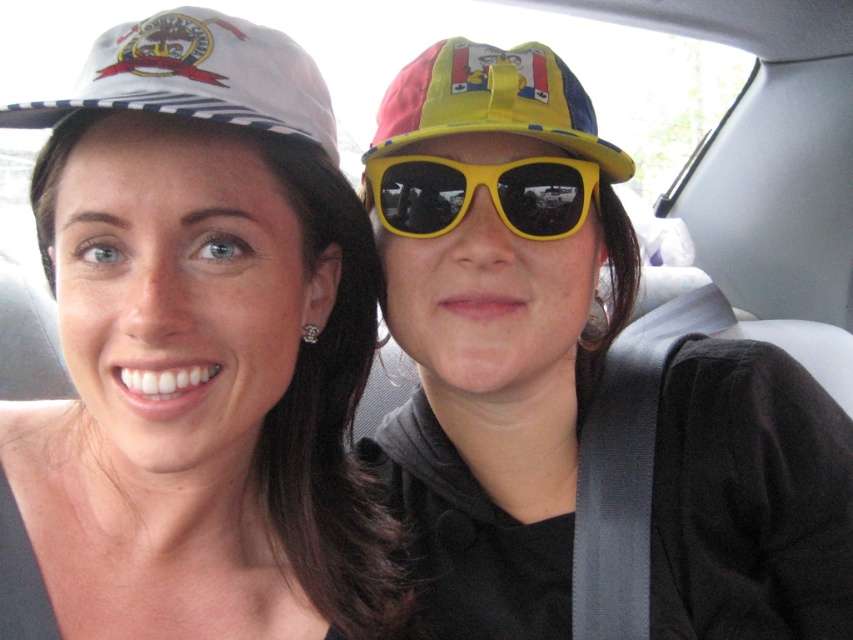
You are a photographer adjusting the camera focus. The yellow matte sunglasses at upper center and the yellow fabric cap at upper center are both in the frame. If the camera can only focus on objects within a 5 inch range, will both items be in focus?

The distance between the yellow matte sunglasses at upper center and the yellow fabric cap at upper center is 6.40 inches, which exceeds the camera focus range of 5 inches. Therefore, both items cannot be in focus simultaneously.

You are a photographer trying to capture a closeup shot of the two people in the car. You notice the white glossy hat at upper left and the white printed baseball cap at upper left. Which of these two hats has a wider brim?

The white glossy hat at upper left has a wider brim than the white printed baseball cap at upper left because its width surpasses the latter.

In the car scene, there are two hats visible at the upper left corner. The first is a white glossy hat at upper left and the second is a white printed baseball cap at upper left. Which of these two hats is positioned further to the left?

The white glossy hat at upper left is positioned to the left of the white printed baseball cap at upper left, so the white glossy hat at upper left is further to the left.